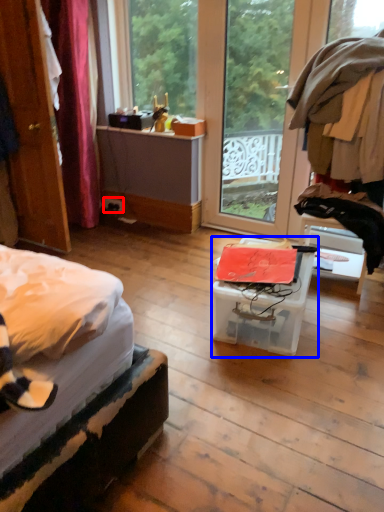
Question: Which object is further to the camera taking this photo, power outlet (highlighted by a red box) or box (highlighted by a blue box)?

Choices:
 (A) power outlet
 (B) box

Answer: (A)